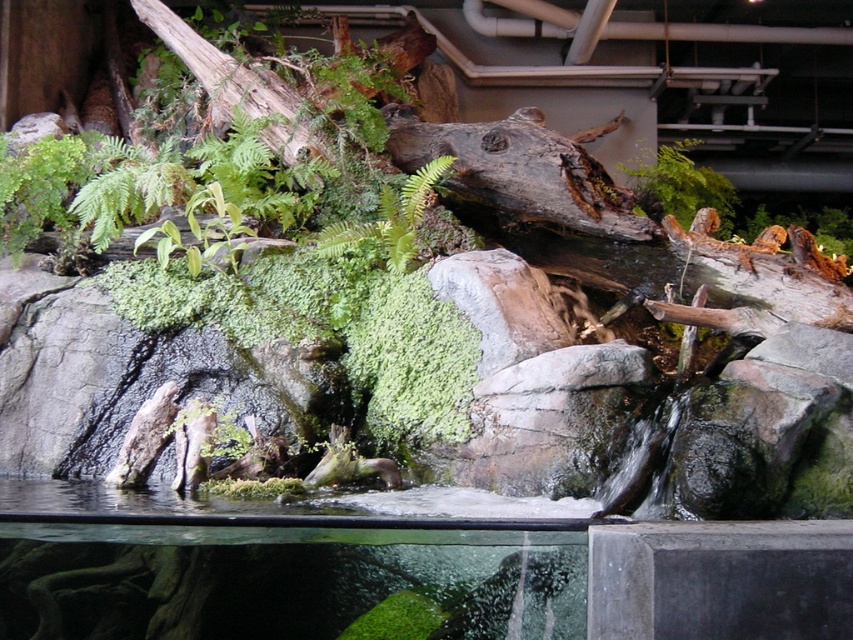
Question: Which of the following is the farthest from the observer?

Choices:
 (A) (415, 220)
 (B) (654, 220)
 (C) (148, 230)
 (D) (9, 196)

Answer: (B)

Question: Which of these objects is positioned farthest from the green fuzzy fern at center?

Choices:
 (A) green fuzzy fern at upper left
 (B) green mossy plant at upper center

Answer: (B)

Question: Is green fuzzy fern at upper left above green leafy plant at center?

Choices:
 (A) yes
 (B) no

Answer: (A)

Question: Can you confirm if green fuzzy fern at center is positioned below green leafy plant at center?

Choices:
 (A) no
 (B) yes

Answer: (A)

Question: Can you confirm if green fuzzy fern at upper left is positioned below green mossy plant at upper center?

Choices:
 (A) no
 (B) yes

Answer: (B)

Question: Which object appears closest to the camera in this image?

Choices:
 (A) green leafy plant at center
 (B) green mossy plant at upper center
 (C) green fuzzy fern at upper left

Answer: (A)